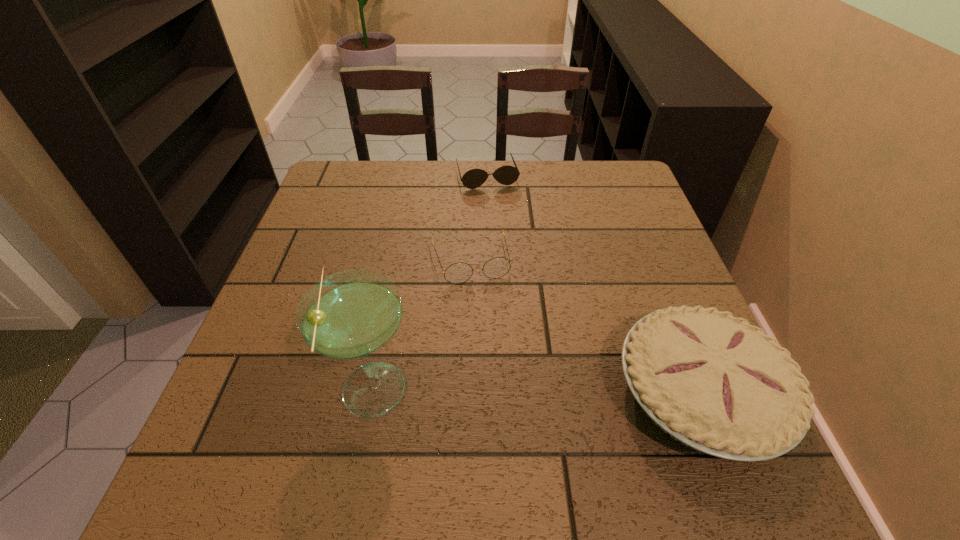
Identify the location of unoccupied position between the martini and the spectacles. (421, 324).

Where is `vacant space that's between the farthest object and the spectacles`? Image resolution: width=960 pixels, height=540 pixels. vacant space that's between the farthest object and the spectacles is located at coordinates coord(478,218).

The image size is (960, 540). I want to click on vacant space in between the rightmost object and the farthest object, so click(x=593, y=285).

Locate an element on the screen. This screenshot has width=960, height=540. empty space that is in between the farthest object and the spectacles is located at coordinates (478, 218).

Locate an element on the screen. Image resolution: width=960 pixels, height=540 pixels. the closest object to the martini is located at coordinates (457, 273).

Identify which object is the closest to the spectacles. Please provide its 2D coordinates. Your answer should be formatted as a tuple, i.e. [(x, y)], where the tuple contains the x and y coordinates of a point satisfying the conditions above.

[(350, 315)]